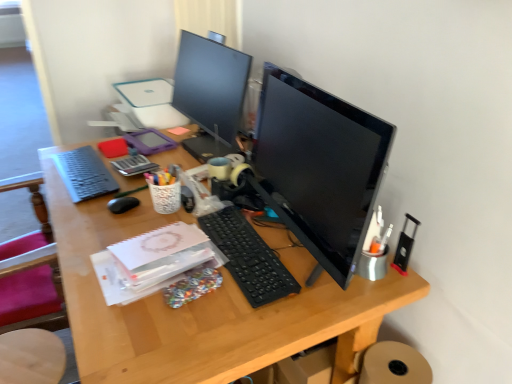
Question: From the image's perspective, does wooden seat at lower left appear lower than black plastic keyboard at center, placed as the second computer keyboard when sorted from back to front?

Choices:
 (A) yes
 (B) no

Answer: (A)

Question: Does wooden seat at lower left have a larger size compared to black plastic keyboard at center, which appears as the first computer keyboard when ordered from the bottom?

Choices:
 (A) yes
 (B) no

Answer: (A)

Question: Is wooden seat at lower left aimed at black plastic keyboard at center, which appears as the first computer keyboard when ordered from the bottom?

Choices:
 (A) no
 (B) yes

Answer: (A)

Question: Are wooden seat at lower left and black plastic keyboard at center, which is counted as the 2th computer keyboard, starting from the left, beside each other?

Choices:
 (A) yes
 (B) no

Answer: (B)

Question: Considering the relative positions of wooden seat at lower left and black plastic keyboard at center, placed as the second computer keyboard when sorted from back to front, in the image provided, is wooden seat at lower left to the right of black plastic keyboard at center, placed as the second computer keyboard when sorted from back to front, from the viewer's perspective?

Choices:
 (A) no
 (B) yes

Answer: (A)

Question: Is wooden seat at lower left taller or shorter than black plastic keyboard at center, positioned as the first computer keyboard in front-to-back order?

Choices:
 (A) tall
 (B) short

Answer: (A)

Question: Is wooden seat at lower left to the left or to the right of black plastic keyboard at center, positioned as the first computer keyboard in front-to-back order, in the image?

Choices:
 (A) left
 (B) right

Answer: (A)

Question: Considering their positions, is wooden seat at lower left located in front of or behind black plastic keyboard at center, positioned as the first computer keyboard in front-to-back order?

Choices:
 (A) front
 (B) behind

Answer: (B)

Question: From the image's perspective, is wooden seat at lower left located above or below black plastic keyboard at center, which is counted as the 2th computer keyboard, starting from the left?

Choices:
 (A) below
 (B) above

Answer: (A)

Question: From a real-world perspective, is matte black keyboard at left, the first computer keyboard positioned from the back, above or below black plastic keyboard at center, placed as the second computer keyboard when sorted from top to bottom?

Choices:
 (A) above
 (B) below

Answer: (A)

Question: In terms of width, does matte black keyboard at left, the first computer keyboard positioned from the back, look wider or thinner when compared to black plastic keyboard at center, positioned as the first computer keyboard in front-to-back order?

Choices:
 (A) thin
 (B) wide

Answer: (B)

Question: Would you say matte black keyboard at left, the second computer keyboard positioned from the bottom, is to the left or to the right of black plastic keyboard at center, which is counted as the 1th computer keyboard, starting from the right, in the picture?

Choices:
 (A) left
 (B) right

Answer: (A)

Question: Considering their positions, is matte black keyboard at left, the 1th computer keyboard viewed from the left, located in front of or behind black plastic keyboard at center, placed as the second computer keyboard when sorted from top to bottom?

Choices:
 (A) behind
 (B) front

Answer: (A)

Question: From the image's perspective, is black matte mouse at center-left above or below matte black keyboard at left, the second computer keyboard positioned from the bottom?

Choices:
 (A) above
 (B) below

Answer: (B)

Question: Considering the positions of black matte mouse at center-left and matte black keyboard at left, positioned as the first computer keyboard in top-to-bottom order, in the image, is black matte mouse at center-left wider or thinner than matte black keyboard at left, positioned as the first computer keyboard in top-to-bottom order,?

Choices:
 (A) wide
 (B) thin

Answer: (B)